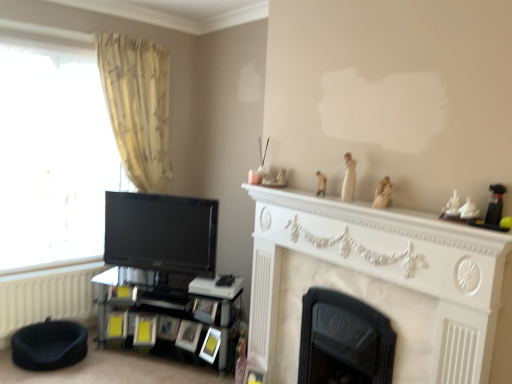
Find the location of a particular element. free spot in front of white porcelain figurine at upper right is located at coordinates (399, 211).